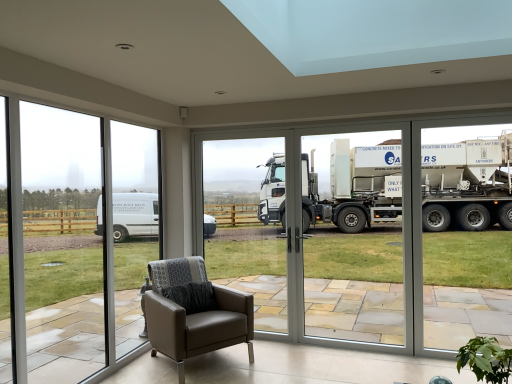
Question: Should I look upward or downward to see green leafy plant at lower right?

Choices:
 (A) up
 (B) down

Answer: (B)

Question: Can you confirm if white glossy truck at center is taller than green leafy plant at lower right?

Choices:
 (A) no
 (B) yes

Answer: (B)

Question: Could green leafy plant at lower right be considered to be inside white glossy truck at center?

Choices:
 (A) no
 (B) yes

Answer: (A)

Question: From a real-world perspective, is white glossy truck at center physically above green leafy plant at lower right?

Choices:
 (A) no
 (B) yes

Answer: (B)

Question: From a real-world perspective, is white glossy truck at center physically below green leafy plant at lower right?

Choices:
 (A) no
 (B) yes

Answer: (A)

Question: Does white glossy truck at center appear on the left side of green leafy plant at lower right?

Choices:
 (A) no
 (B) yes

Answer: (B)

Question: Can you confirm if white glossy truck at center is smaller than green leafy plant at lower right?

Choices:
 (A) no
 (B) yes

Answer: (A)

Question: From the image's perspective, would you say transparent glass door at center is shown under brown leather armchair at lower center?

Choices:
 (A) yes
 (B) no

Answer: (B)

Question: Is transparent glass door at center not near brown leather armchair at lower center?

Choices:
 (A) yes
 (B) no

Answer: (A)

Question: Is the depth of transparent glass door at center greater than that of brown leather armchair at lower center?

Choices:
 (A) no
 (B) yes

Answer: (B)

Question: Is transparent glass door at center thinner than brown leather armchair at lower center?

Choices:
 (A) yes
 (B) no

Answer: (A)

Question: From a real-world perspective, is transparent glass door at center over brown leather armchair at lower center?

Choices:
 (A) yes
 (B) no

Answer: (A)

Question: Is transparent glass door at center facing towards brown leather armchair at lower center?

Choices:
 (A) yes
 (B) no

Answer: (A)

Question: Is transparent glass door at center beside transparent glass window at left?

Choices:
 (A) yes
 (B) no

Answer: (B)